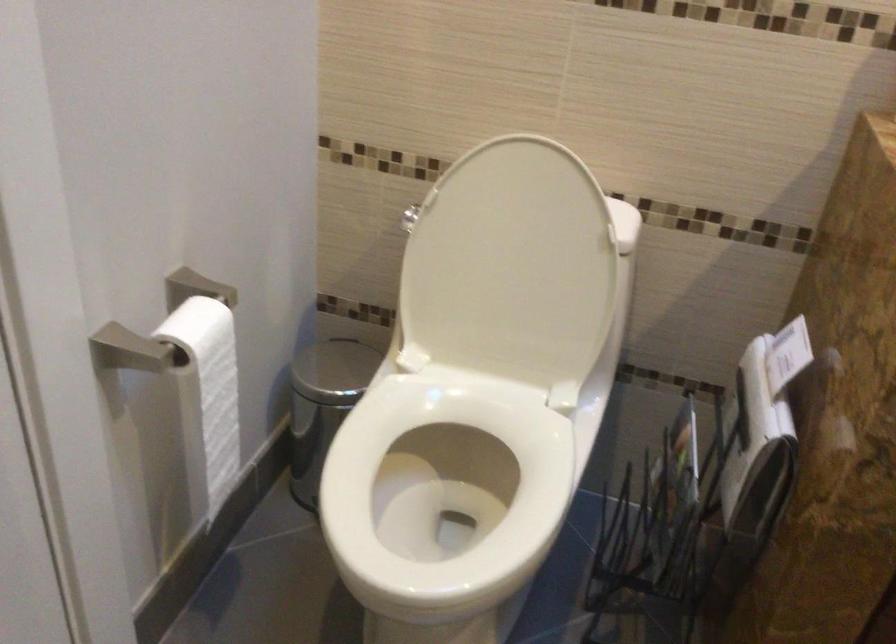
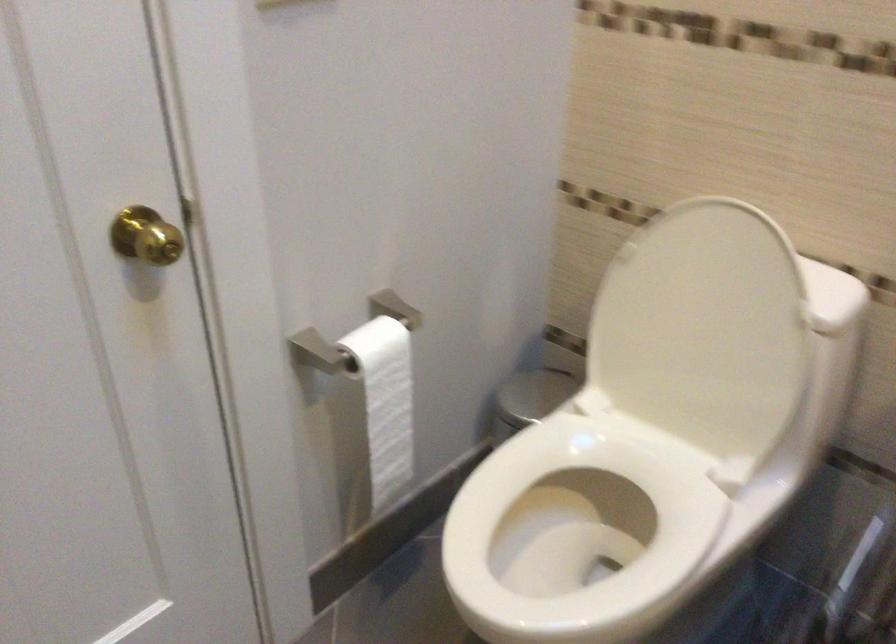
Question: The first image is from the beginning of the video and the second image is from the end. How did the camera likely rotate when shooting the video?

Choices:
 (A) Left
 (B) Right
 (C) Up
 (D) Down

Answer: (A)